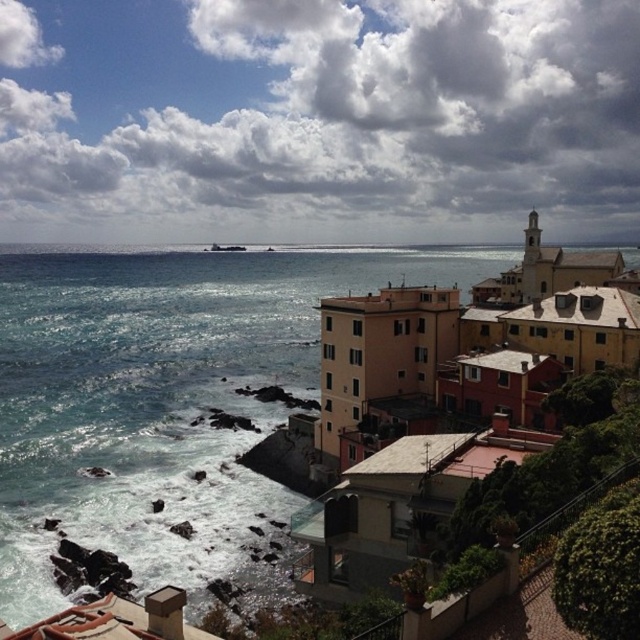
Question: Which object appears farthest from the camera in this image?

Choices:
 (A) blue water at center
 (B) matte yellow building at center

Answer: (A)

Question: Is blue water at center to the left of matte yellow building at center from the viewer's perspective?

Choices:
 (A) yes
 (B) no

Answer: (A)

Question: Among these objects, which one is farthest from the camera?

Choices:
 (A) matte yellow building at center
 (B) blue water at center

Answer: (B)

Question: Can you confirm if blue water at center is wider than matte yellow building at center?

Choices:
 (A) no
 (B) yes

Answer: (B)

Question: Is blue water at center positioned in front of matte yellow building at center?

Choices:
 (A) no
 (B) yes

Answer: (A)